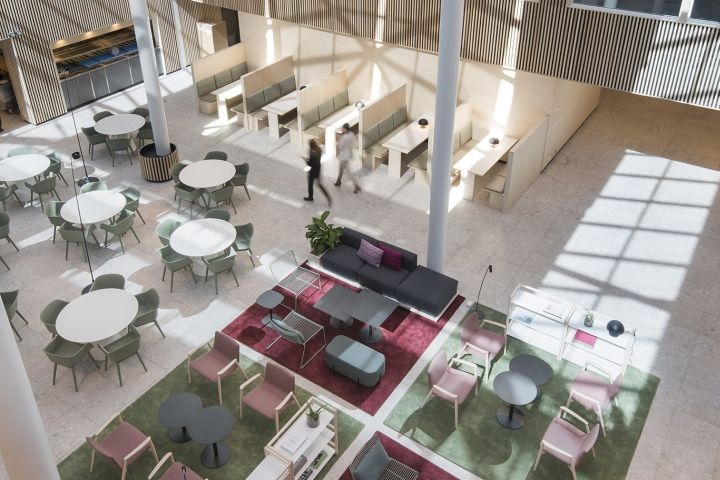
Where is `white round table`? This screenshot has height=480, width=720. white round table is located at coordinates (98, 321), (199, 238), (207, 172), (17, 169), (96, 205), (120, 122).